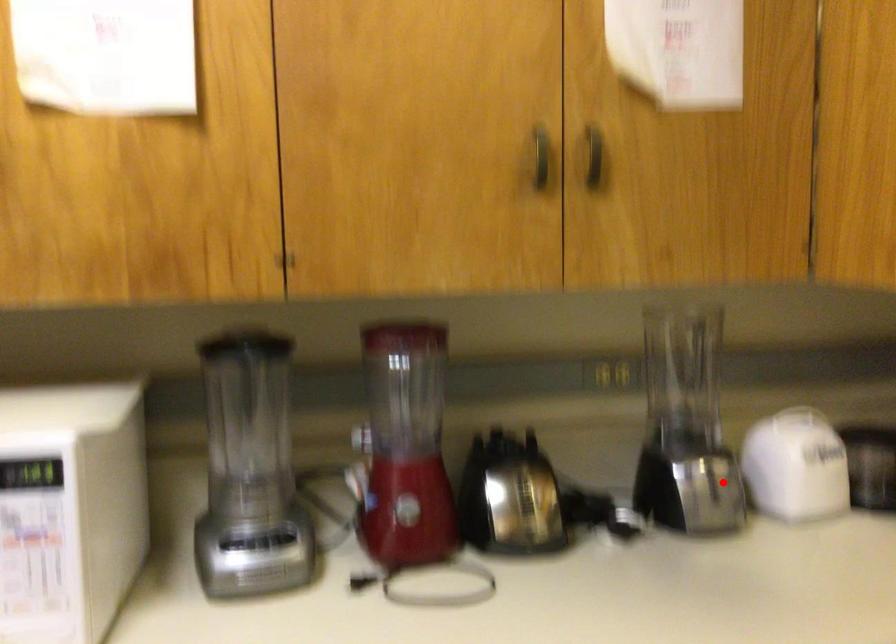
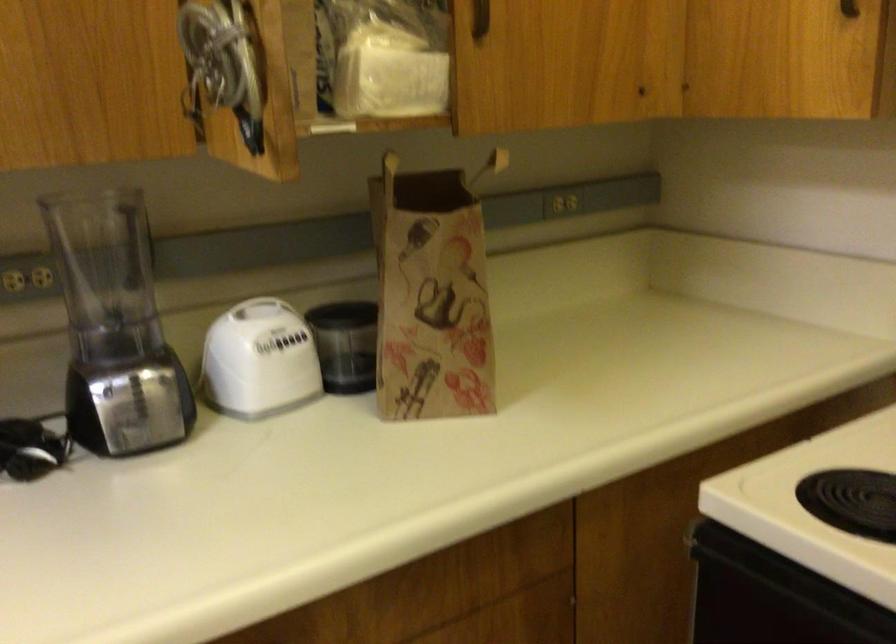
Question: A red point is marked in image1. In image2, is the corresponding 3D point closer to the camera or farther? Reply with the corresponding letter.

Choices:
 (A) The corresponding 3D point is closer.
 (B) The corresponding 3D point is farther.

Answer: (A)